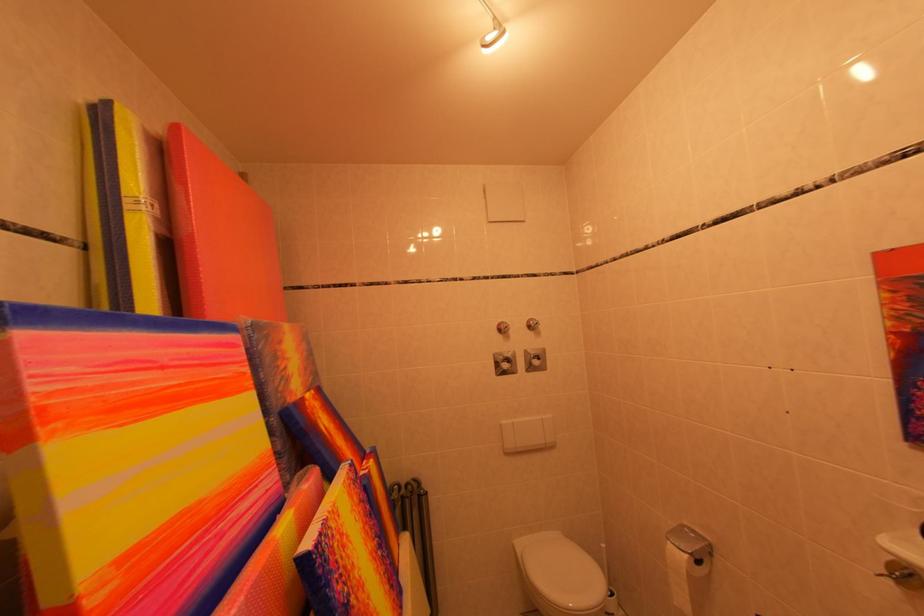
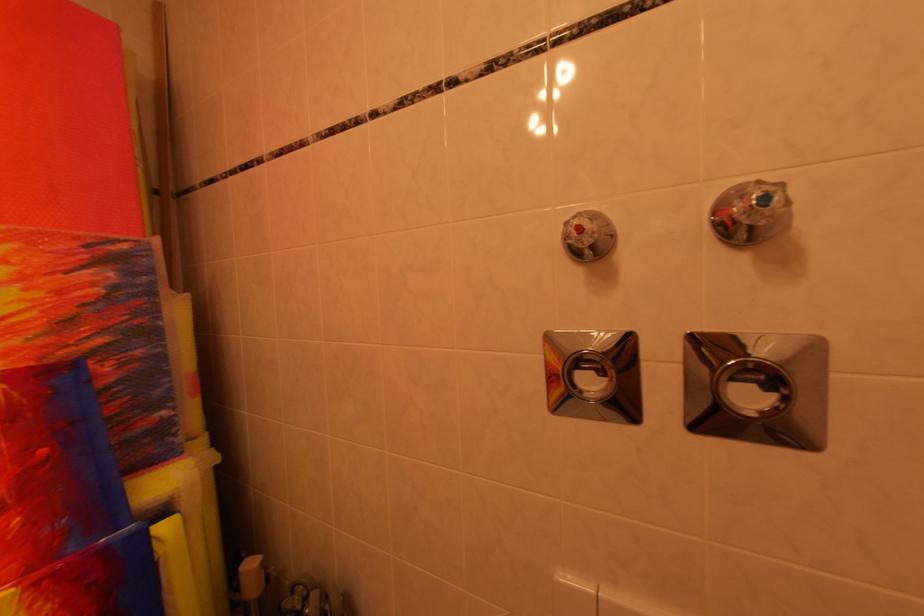
Find the pixel in the second image that matches the point at 553,354 in the first image.

(824, 351)